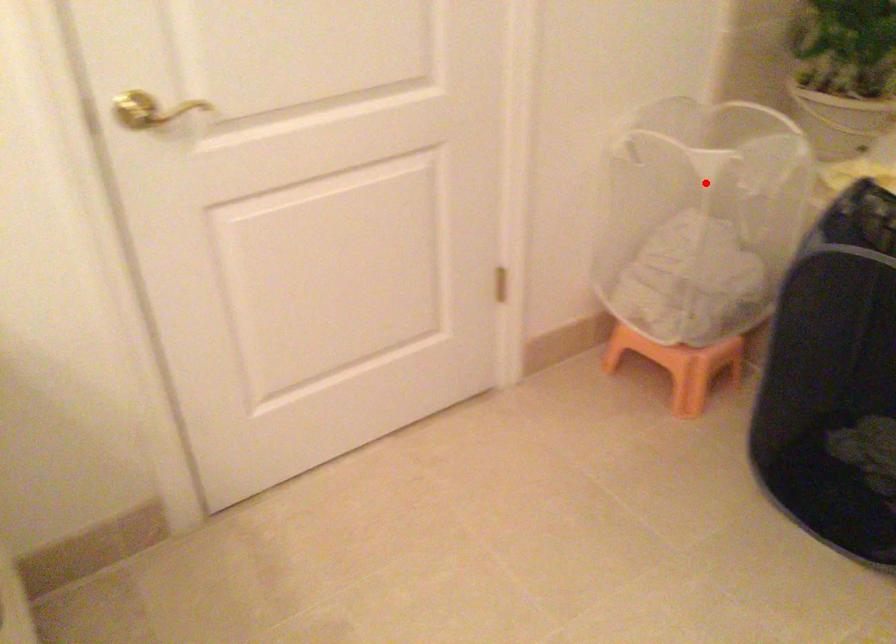
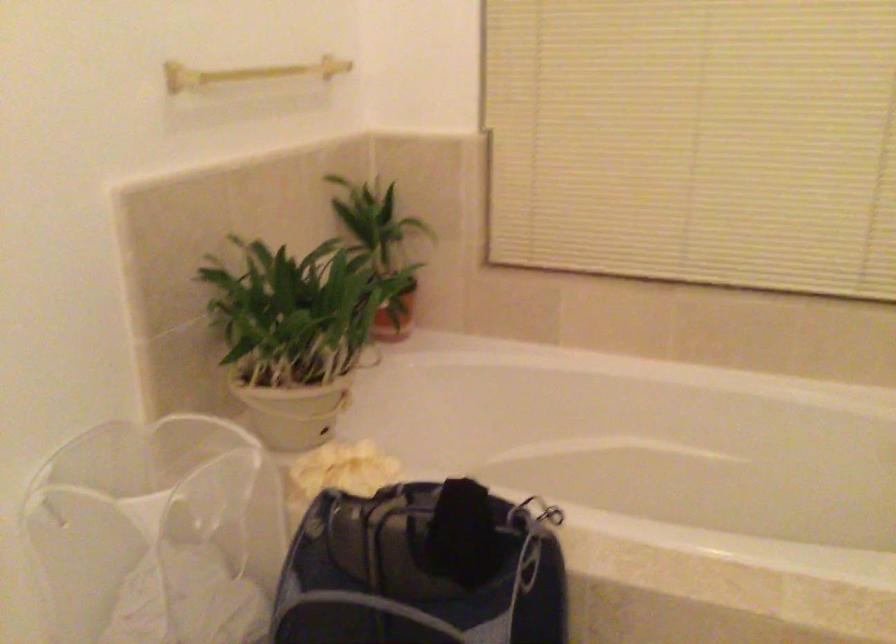
Locate, in the second image, the point that corresponds to the highlighted location in the first image.

(157, 534)